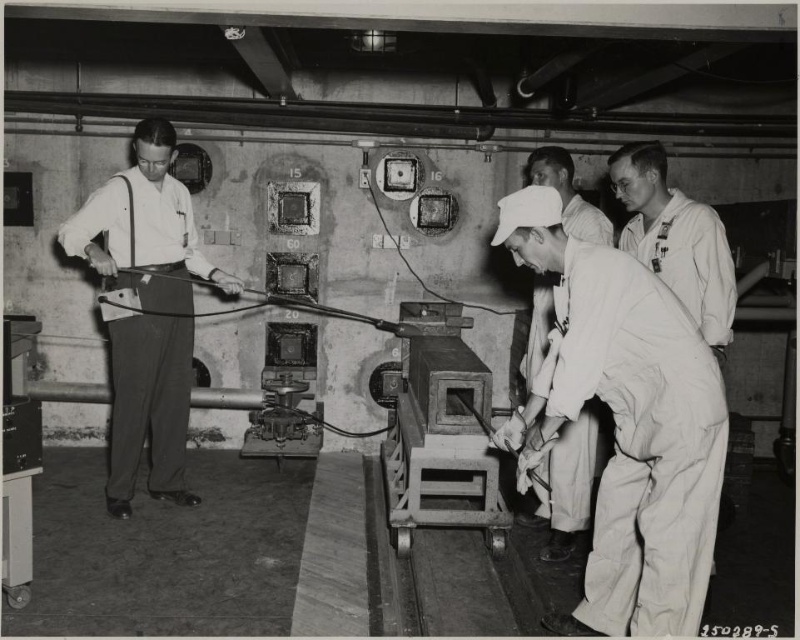
Locate an element on the screen. The height and width of the screenshot is (640, 800). white cotton overalls at center is located at coordinates (624, 424).

In the scene shown: Does white cotton overalls at center have a lesser height compared to white cotton shirt at center?

Incorrect, white cotton overalls at center's height does not fall short of white cotton shirt at center's.

Is point (613, 352) more distant than point (590, 214)?

No, (613, 352) is in front of (590, 214).

The image size is (800, 640). Find the location of `white cotton overalls at center`. white cotton overalls at center is located at coordinates (624, 424).

Between point (717, 346) and point (548, 518), which one is positioned in front?

Point (717, 346) is in front.

Between white fabric uniform at center and white cotton shirt at center, which one has more height?

Standing taller between the two is white cotton shirt at center.

Which is in front, point (698, 298) or point (540, 300)?

Point (698, 298) is in front.

The width and height of the screenshot is (800, 640). I want to click on white fabric uniform at center, so click(x=676, y=240).

Does point (140, 298) lie in front of point (572, 449)?

No.

Between white matte shirt at left and white cotton shirt at center, which one has more height?

With more height is white matte shirt at left.

Does point (126, 472) lie behind point (578, 438)?

Yes, point (126, 472) is farther from viewer.

Locate an element on the screen. white matte shirt at left is located at coordinates (146, 308).